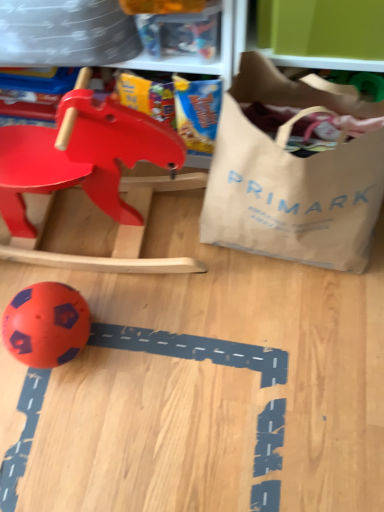
Question: Does matte plastic rocking horse at upper left, the first toy when ordered from top to bottom, have a lesser height compared to brown paper bag at right?

Choices:
 (A) no
 (B) yes

Answer: (B)

Question: Is matte plastic rocking horse at upper left, the first toy when ordered from top to bottom, bigger than brown paper bag at right?

Choices:
 (A) no
 (B) yes

Answer: (B)

Question: Could brown paper bag at right be considered to be inside matte plastic rocking horse at upper left, the first toy when ordered from top to bottom?

Choices:
 (A) yes
 (B) no

Answer: (B)

Question: Is matte plastic rocking horse at upper left, placed as the second toy when sorted from bottom to top, placed right next to brown paper bag at right?

Choices:
 (A) no
 (B) yes

Answer: (A)

Question: Does matte plastic rocking horse at upper left, the first toy when ordered from top to bottom, appear on the left side of brown paper bag at right?

Choices:
 (A) yes
 (B) no

Answer: (A)

Question: Is point (56, 293) positioned closer to the camera than point (213, 202)?

Choices:
 (A) farther
 (B) closer

Answer: (B)

Question: Is orange rubber ball at lower left, positioned as the first toy in bottom-to-top order, to the left or to the right of brown paper bag at right in the image?

Choices:
 (A) left
 (B) right

Answer: (A)

Question: From a real-world perspective, is orange rubber ball at lower left, the 2th toy positioned from the top, positioned above or below brown paper bag at right?

Choices:
 (A) above
 (B) below

Answer: (B)

Question: Considering the positions of orange rubber ball at lower left, positioned as the first toy in bottom-to-top order, and brown paper bag at right in the image, is orange rubber ball at lower left, positioned as the first toy in bottom-to-top order, taller or shorter than brown paper bag at right?

Choices:
 (A) tall
 (B) short

Answer: (B)

Question: Visually, is brown paper bag at right positioned to the left or to the right of orange rubber ball at lower left, the 2th toy positioned from the top?

Choices:
 (A) right
 (B) left

Answer: (A)

Question: From a real-world perspective, relative to orange rubber ball at lower left, the 2th toy positioned from the top, is brown paper bag at right vertically above or below?

Choices:
 (A) above
 (B) below

Answer: (A)

Question: Based on their sizes in the image, would you say brown paper bag at right is bigger or smaller than orange rubber ball at lower left, the 2th toy positioned from the top?

Choices:
 (A) small
 (B) big

Answer: (B)

Question: Is brown paper bag at right in front of or behind orange rubber ball at lower left, the 2th toy positioned from the top, in the image?

Choices:
 (A) behind
 (B) front

Answer: (B)

Question: Based on their sizes in the image, would you say orange rubber ball at lower left, positioned as the first toy in bottom-to-top order, is bigger or smaller than matte plastic rocking horse at upper left, placed as the second toy when sorted from bottom to top?

Choices:
 (A) small
 (B) big

Answer: (A)

Question: Does point (46, 349) appear closer or farther from the camera than point (96, 144)?

Choices:
 (A) closer
 (B) farther

Answer: (B)